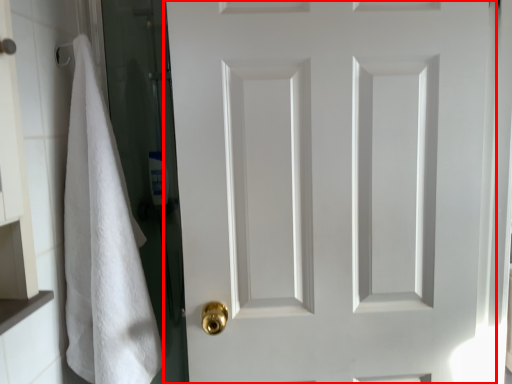
Question: Observing the image, what is the correct spatial positioning of door (annotated by the red box) in reference to bath towel?

Choices:
 (A) right
 (B) left

Answer: (A)